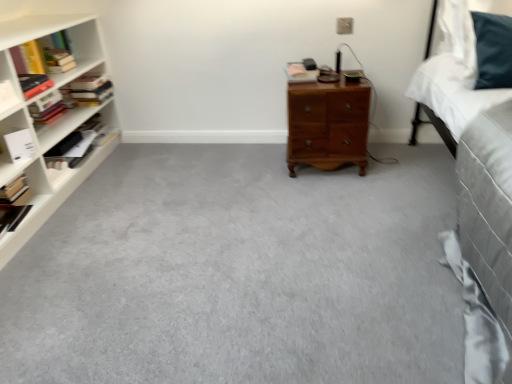
Question: From a real-world perspective, is hardcover books at left, which appears as the fifth book when viewed from the right, physically located above or below hardcover book at center, marked as the 1th book in a right-to-left arrangement?

Choices:
 (A) below
 (B) above

Answer: (A)

Question: Looking at the image, does hardcover books at left, which appears as the fifth book when viewed from the right, seem bigger or smaller compared to hardcover book at center, marked as the 1th book in a right-to-left arrangement?

Choices:
 (A) big
 (B) small

Answer: (A)

Question: Considering the real-world distances, which object is closest to the hardcover book at center, marked as the 1th book in a right-to-left arrangement?

Choices:
 (A) hardcover books at left, marked as the 4th book in a left-to-right arrangement
 (B) hardcover book at left, which is the second book from left to right
 (C) white matte book at left, the 2th book in the right-to-left sequence
 (D) hardcover book at left, which ranks as the 8th book in right-to-left order
 (E) wooden nightstand at center

Answer: (E)

Question: Based on their relative distances, which object is nearer to the hardcover book at left, which ranks as the 8th book in right-to-left order?

Choices:
 (A) yellow paperback book at left, which is the 3th book in left-to-right order
 (B) hardcover book at center, acting as the 8th book starting from the left
 (C) hardcover books at left, placed as the 4th book when sorted from right to left
 (D) hardcover book at left, placed as the 6th book when sorted from left to right
 (E) wooden nightstand at center

Answer: (D)